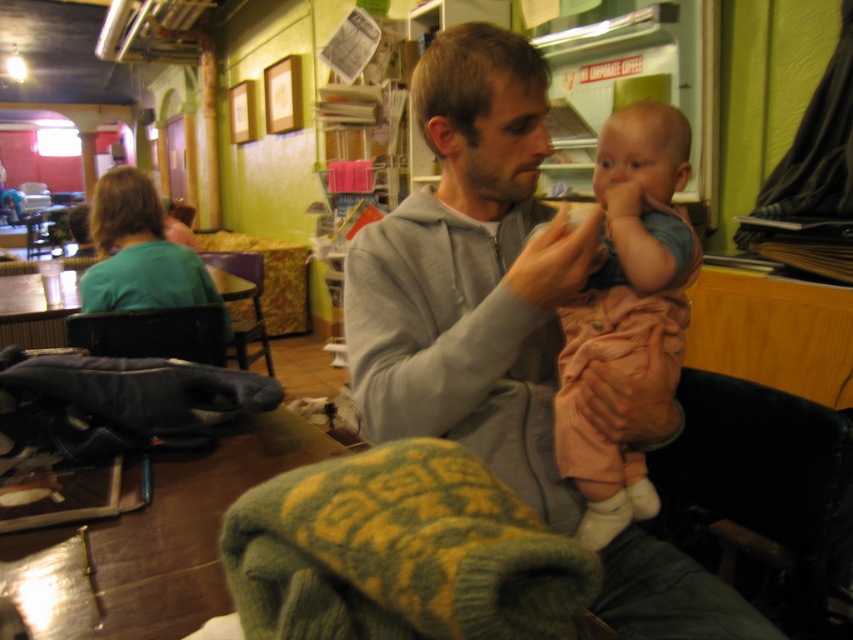
Which is in front, point (601, 134) or point (251, 353)?

Point (601, 134)

Looking at this image, which is more to the right, pink fabric baby at center or wooden chair at center?

From the viewer's perspective, pink fabric baby at center appears more on the right side.

Find the location of `pink fabric baby at center`. pink fabric baby at center is located at coordinates (625, 305).

Between pink fabric baby at center and black leather chair at lower left, which one has less height?

With less height is black leather chair at lower left.

Does pink fabric baby at center lie in front of black leather chair at lower left?

Yes, pink fabric baby at center is in front of black leather chair at lower left.

Locate an element on the screen. This screenshot has width=853, height=640. pink fabric baby at center is located at coordinates (625, 305).

This screenshot has width=853, height=640. What are the coordinates of `pink fabric baby at center` in the screenshot? It's located at (625, 305).

Is black leather chair at lower left smaller than wooden chair at center?

Indeed, black leather chair at lower left has a smaller size compared to wooden chair at center.

Based on the photo, who is positioned more to the right, black leather chair at lower left or wooden chair at center?

Positioned to the right is black leather chair at lower left.

Find the location of a particular element. The image size is (853, 640). black leather chair at lower left is located at coordinates (154, 333).